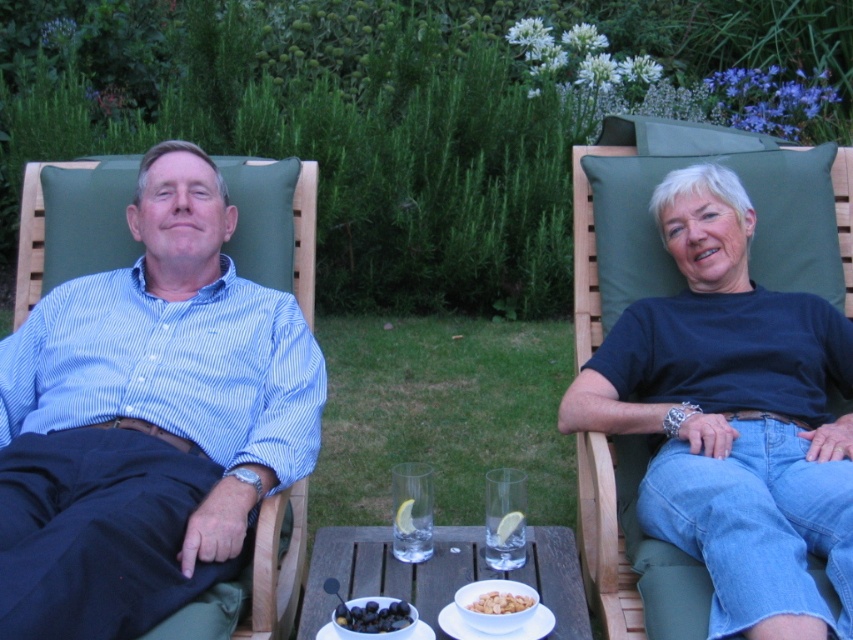
Which is more to the right, dark blue t-shirt at right or black matte grapes at lower center?

From the viewer's perspective, dark blue t-shirt at right appears more on the right side.

Does dark blue t-shirt at right appear on the right side of black matte grapes at lower center?

Indeed, dark blue t-shirt at right is positioned on the right side of black matte grapes at lower center.

Does point (788, 454) come in front of point (370, 614)?

No, it is not.

Find the location of a particular element. This screenshot has height=640, width=853. dark blue t-shirt at right is located at coordinates (730, 417).

Consider the image. Who is positioned more to the right, blue striped shirt at left or black matte grapes at lower center?

black matte grapes at lower center is more to the right.

How far apart are blue striped shirt at left and black matte grapes at lower center?

blue striped shirt at left and black matte grapes at lower center are 26.30 inches apart.

At what (x,y) coordinates should I click in order to perform the action: click on blue striped shirt at left. Please return your answer as a coordinate pair (x, y). This screenshot has width=853, height=640. Looking at the image, I should click on (238, 403).

Does dark blue t-shirt at right lie in front of white matte bowl at lower center?

Yes, it is in front of white matte bowl at lower center.

Is dark blue t-shirt at right further to camera compared to white matte bowl at lower center?

No, it is in front of white matte bowl at lower center.

Measure the distance between dark blue t-shirt at right and camera.

dark blue t-shirt at right and camera are 5.20 feet apart from each other.

Locate an element on the screen. The width and height of the screenshot is (853, 640). dark blue t-shirt at right is located at coordinates pos(730,417).